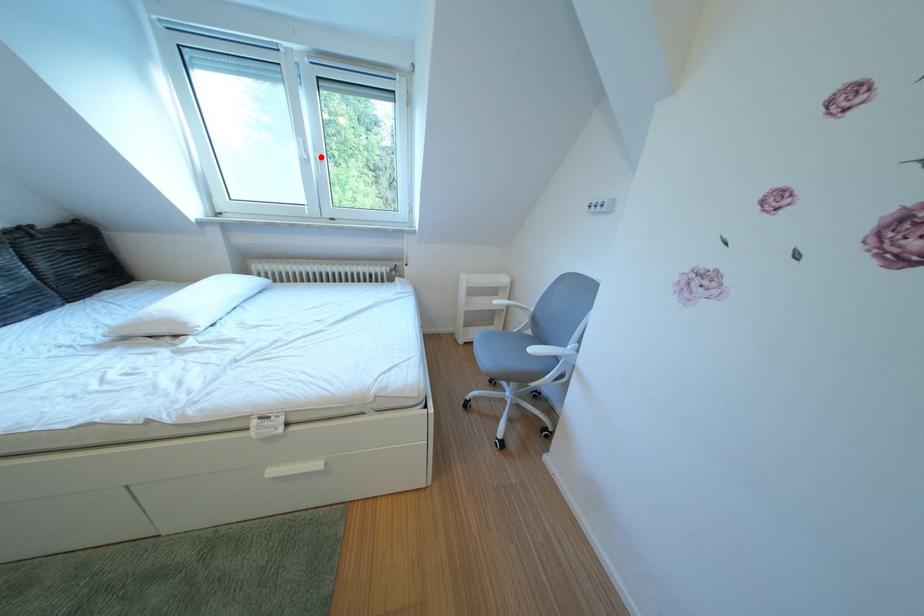
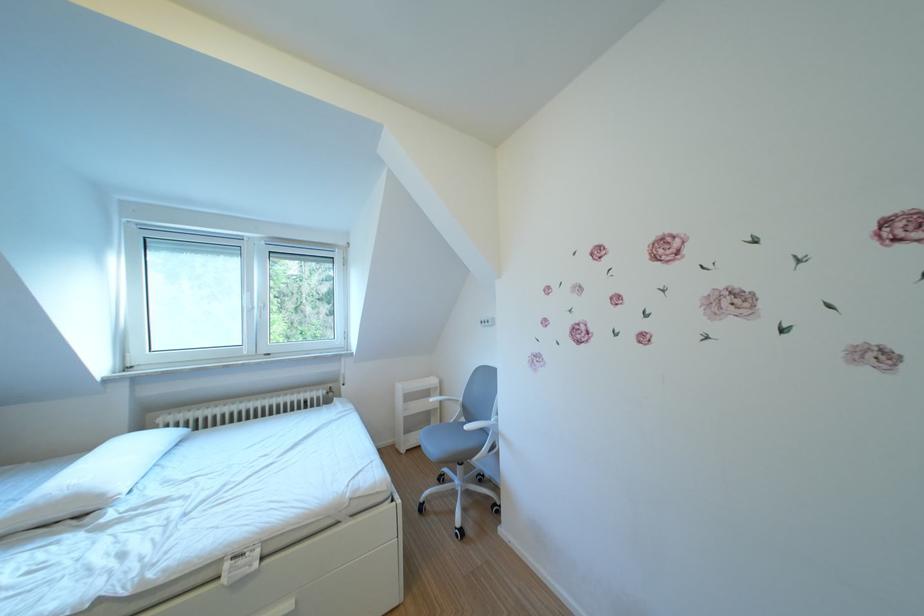
The point at the highlighted location is marked in the first image. Where is the corresponding point in the second image?

(265, 307)